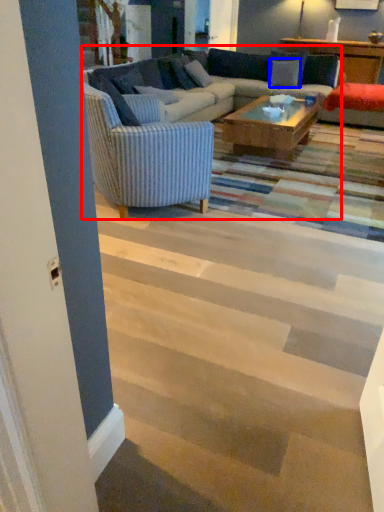
Question: Which object appears farthest to the camera in this image, studio couch (highlighted by a red box) or pillow (highlighted by a blue box)?

Choices:
 (A) studio couch
 (B) pillow

Answer: (B)